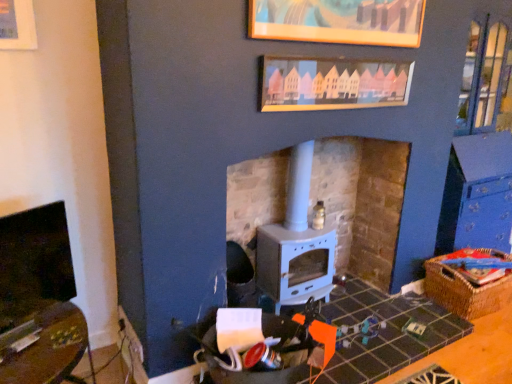
Question: From a real-world perspective, does woven brown basket at lower right stand above white matte wood burning stove at center?

Choices:
 (A) yes
 (B) no

Answer: (B)

Question: Does woven brown basket at lower right appear on the left side of white matte wood burning stove at center?

Choices:
 (A) yes
 (B) no

Answer: (B)

Question: Would you say woven brown basket at lower right is outside white matte wood burning stove at center?

Choices:
 (A) yes
 (B) no

Answer: (A)

Question: Does woven brown basket at lower right contain white matte wood burning stove at center?

Choices:
 (A) yes
 (B) no

Answer: (B)

Question: Can you confirm if woven brown basket at lower right is wider than white matte wood burning stove at center?

Choices:
 (A) yes
 (B) no

Answer: (A)

Question: In the image, is matte black fireplace at left on the left side or the right side of white matte wood burning stove at center?

Choices:
 (A) left
 (B) right

Answer: (A)

Question: In the image, is matte black fireplace at left positioned in front of or behind white matte wood burning stove at center?

Choices:
 (A) behind
 (B) front

Answer: (B)

Question: Based on their sizes in the image, would you say matte black fireplace at left is bigger or smaller than white matte wood burning stove at center?

Choices:
 (A) small
 (B) big

Answer: (A)

Question: Is matte black fireplace at left situated inside white matte wood burning stove at center or outside?

Choices:
 (A) inside
 (B) outside

Answer: (B)

Question: Is white matte wood burning stove at center wider or thinner than matte black fireplace at left?

Choices:
 (A) wide
 (B) thin

Answer: (A)

Question: Looking at the image, does white matte wood burning stove at center seem bigger or smaller compared to matte black fireplace at left?

Choices:
 (A) big
 (B) small

Answer: (A)

Question: Is white matte wood burning stove at center taller or shorter than matte black fireplace at left?

Choices:
 (A) tall
 (B) short

Answer: (A)

Question: From a real-world perspective, is white matte wood burning stove at center above or below matte black fireplace at left?

Choices:
 (A) above
 (B) below

Answer: (B)

Question: From a real-world perspective, is wooden picture frame at upper center, the 2th picture frame from the bottom, positioned above or below wooden picture frame at upper center, arranged as the 2th picture frame when viewed from the top?

Choices:
 (A) above
 (B) below

Answer: (A)

Question: Would you say wooden picture frame at upper center, the 2th picture frame from the bottom, is to the left or to the right of wooden picture frame at upper center, arranged as the 2th picture frame when viewed from the top, in the picture?

Choices:
 (A) left
 (B) right

Answer: (A)